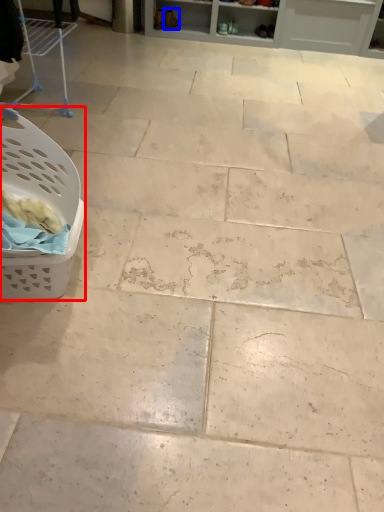
Question: Which point is closer to the camera, basket (highlighted by a red box) or footwear (highlighted by a blue box)?

Choices:
 (A) basket
 (B) footwear

Answer: (A)